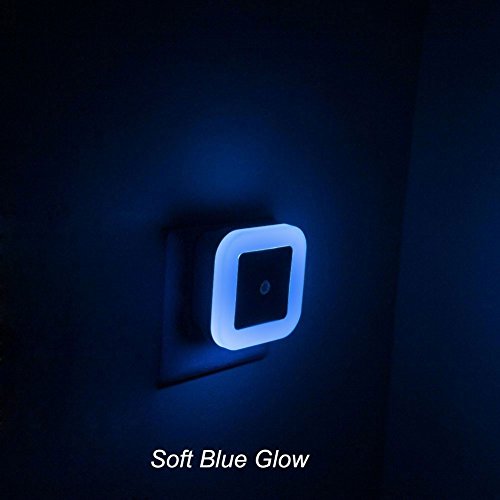
Identify the location of glowing light. This screenshot has width=500, height=500. (234, 342).